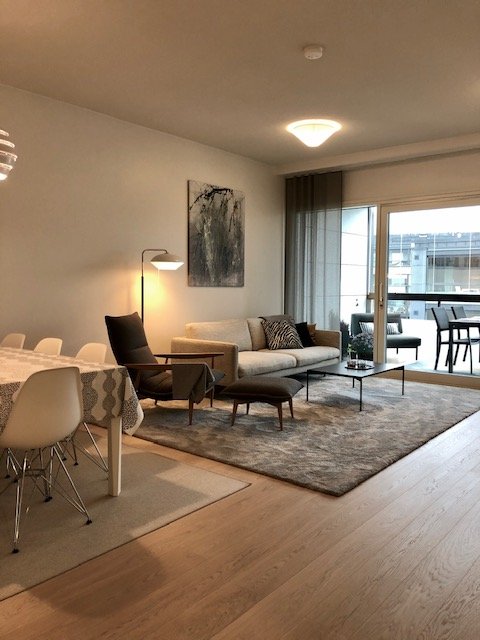
The image size is (480, 640). What are the coordinates of `door to balcony` in the screenshot? It's located at (384, 278).